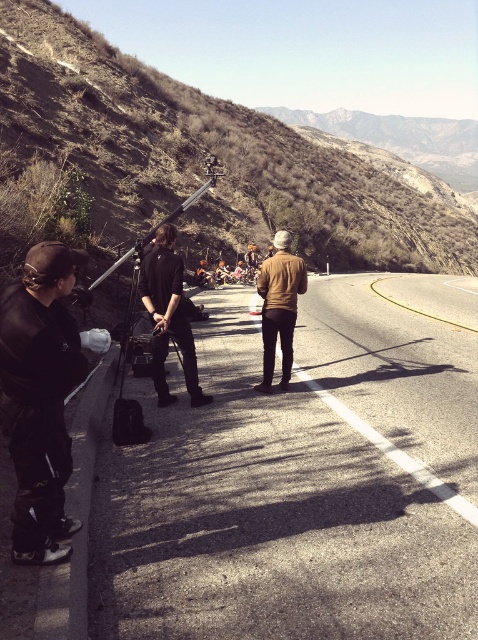
Question: Which object appears closest to the camera in this image?

Choices:
 (A) smooth asphalt highway at center
 (B) brown leather jacket at center
 (C) black leather jacket at center
 (D) matte black jacket at left

Answer: (A)

Question: Is smooth asphalt highway at center further to camera compared to matte black jacket at left?

Choices:
 (A) yes
 (B) no

Answer: (B)

Question: Does black leather jacket at center have a smaller size compared to brown leather jacket at center?

Choices:
 (A) yes
 (B) no

Answer: (A)

Question: Which object is the farthest from the brown leather jacket at center?

Choices:
 (A) smooth asphalt highway at center
 (B) matte black jacket at left

Answer: (B)

Question: From the image, what is the correct spatial relationship of matte black jacket at left in relation to brown leather jacket at center?

Choices:
 (A) above
 (B) below

Answer: (B)

Question: Which of the following is the farthest from the observer?

Choices:
 (A) (289, 269)
 (B) (136, 506)

Answer: (A)